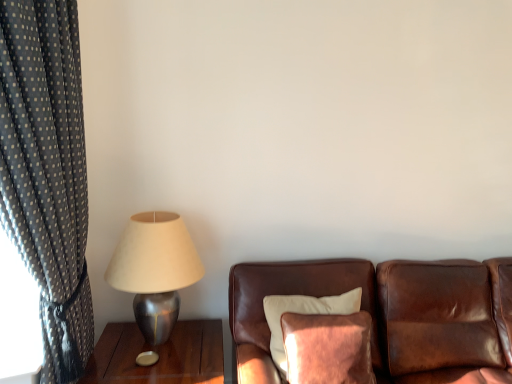
Where is `blank space above metallic silver table at left (from a real-world perspective)`? The image size is (512, 384). blank space above metallic silver table at left (from a real-world perspective) is located at coordinates (159, 355).